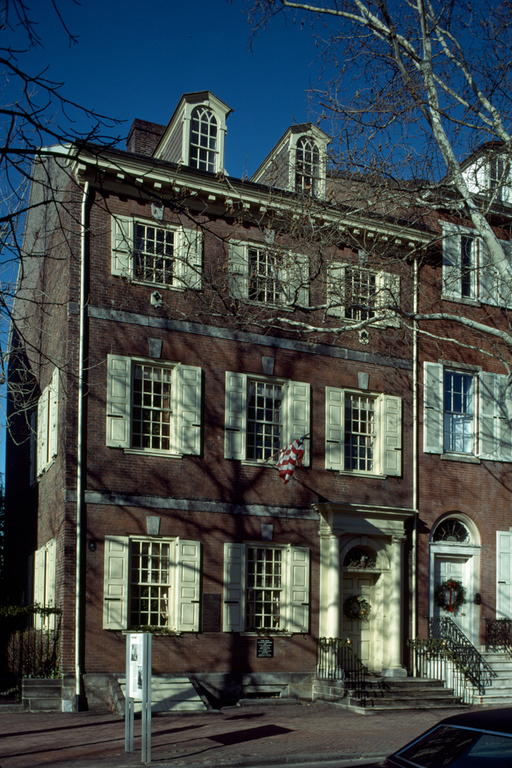
Where is `door`? door is located at coordinates (355, 641), (465, 616).